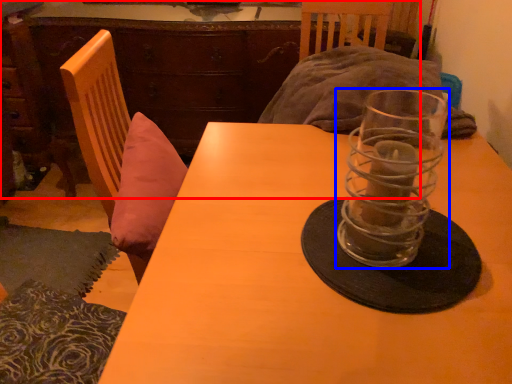
Question: Which of the following is the closest to the observer, dresser (highlighted by a red box) or tableware (highlighted by a blue box)?

Choices:
 (A) dresser
 (B) tableware

Answer: (B)